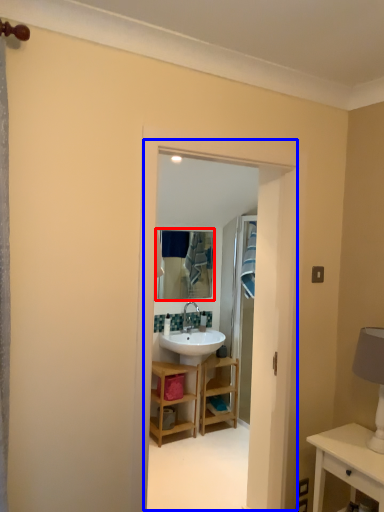
Question: Among these objects, which one is nearest to the camera, mirror (highlighted by a red box) or residence (highlighted by a blue box)?

Choices:
 (A) mirror
 (B) residence

Answer: (B)